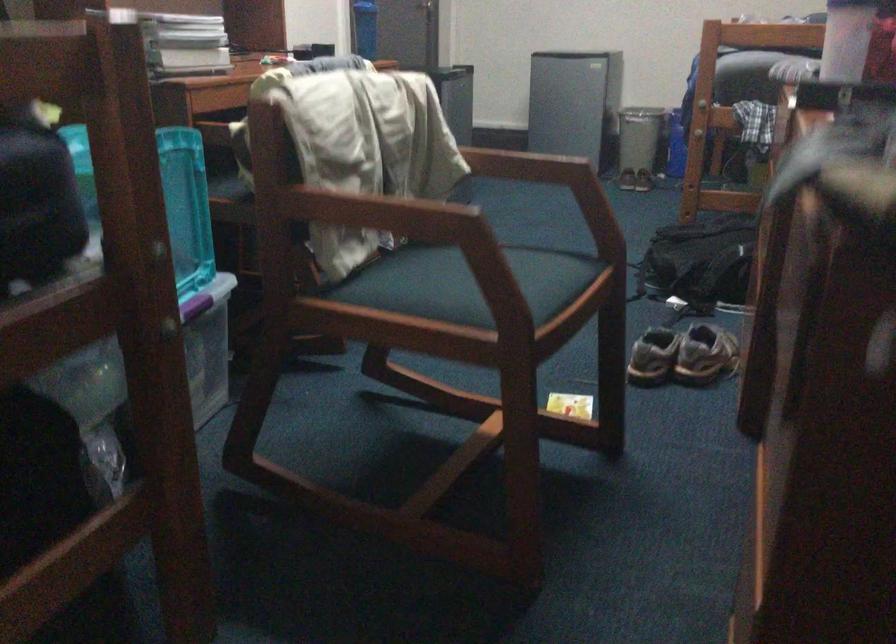
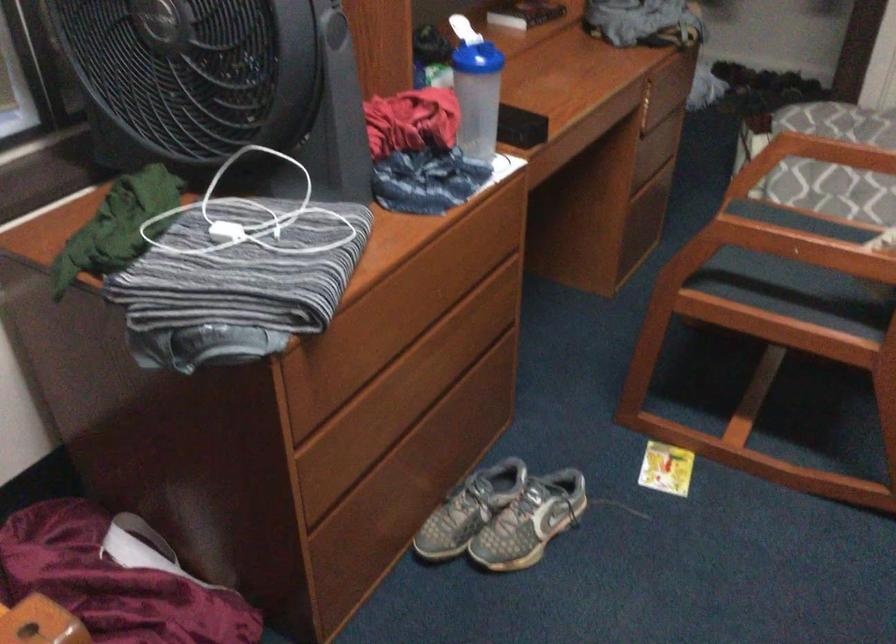
Where in the second image is the point corresponding to (x=498, y=154) from the first image?

(826, 234)